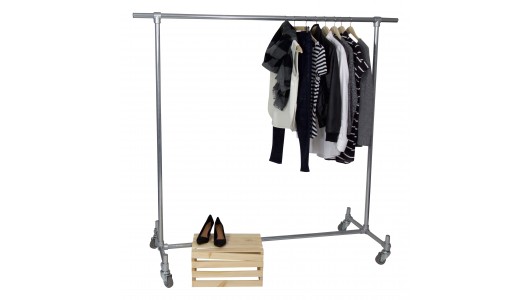
You are a GUI agent. You are given a task and a screenshot of the screen. Output one action in this format:
    pyautogui.click(x=<x>, y=<y>)
    Task: Click on the wheels on clothes rack
    This screenshot has height=300, width=530.
    Given the screenshot: What is the action you would take?
    pyautogui.click(x=151, y=243), pyautogui.click(x=170, y=284), pyautogui.click(x=341, y=225), pyautogui.click(x=379, y=261)